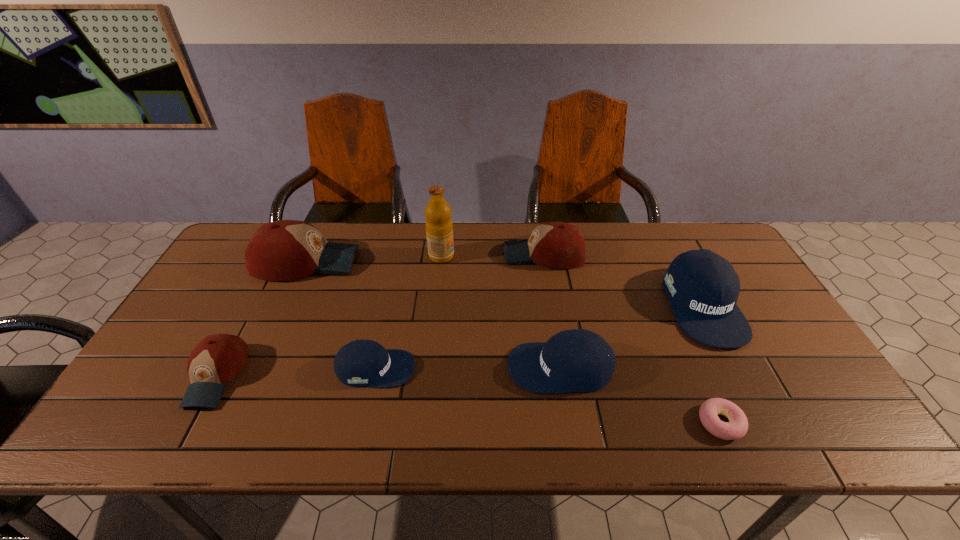
Locate an element on the screen. The width and height of the screenshot is (960, 540). doughnut is located at coordinates (736, 428).

Find the location of a particular element. vacant position located on the front label of the tallest object is located at coordinates (482, 256).

Find the location of a particular element. free space located on the front-facing side of the biggest red baseball cap is located at coordinates (426, 262).

The image size is (960, 540). I want to click on free point located on the front-facing side of the rightmost baseball cap, so click(742, 380).

Identify the location of vacant area located 0.260m on the front-facing side of the second smallest red baseball cap. This screenshot has height=540, width=960. (423, 254).

You are a GUI agent. You are given a task and a screenshot of the screen. Output one action in this format:
    pyautogui.click(x=<x>, y=<y>)
    Task: Click on the free spot located on the front-facing side of the second smallest red baseball cap
    The image size is (960, 540).
    Given the screenshot: What is the action you would take?
    pyautogui.click(x=447, y=254)

Locate an element on the screen. vacant space situated 0.050m on the front-facing side of the second smallest red baseball cap is located at coordinates (488, 254).

Where is `free location located on the front-facing side of the second blue baseball cap from right to left`? The image size is (960, 540). free location located on the front-facing side of the second blue baseball cap from right to left is located at coordinates (372, 368).

Image resolution: width=960 pixels, height=540 pixels. What are the coordinates of `free region located 0.150m on the front-facing side of the second blue baseball cap from right to left` in the screenshot? It's located at (447, 368).

Locate an element on the screen. vacant region located on the front-facing side of the second blue baseball cap from right to left is located at coordinates (468, 368).